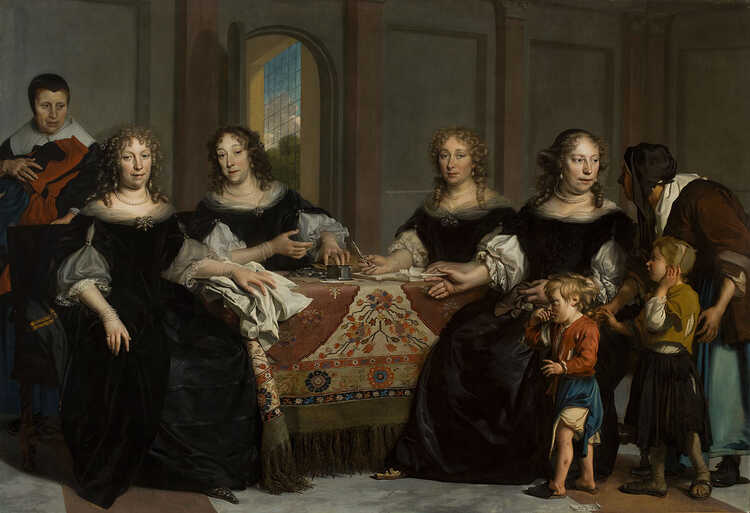
Image resolution: width=750 pixels, height=513 pixels. In order to click on large picture window in this screenshot , I will do `click(283, 117)`.